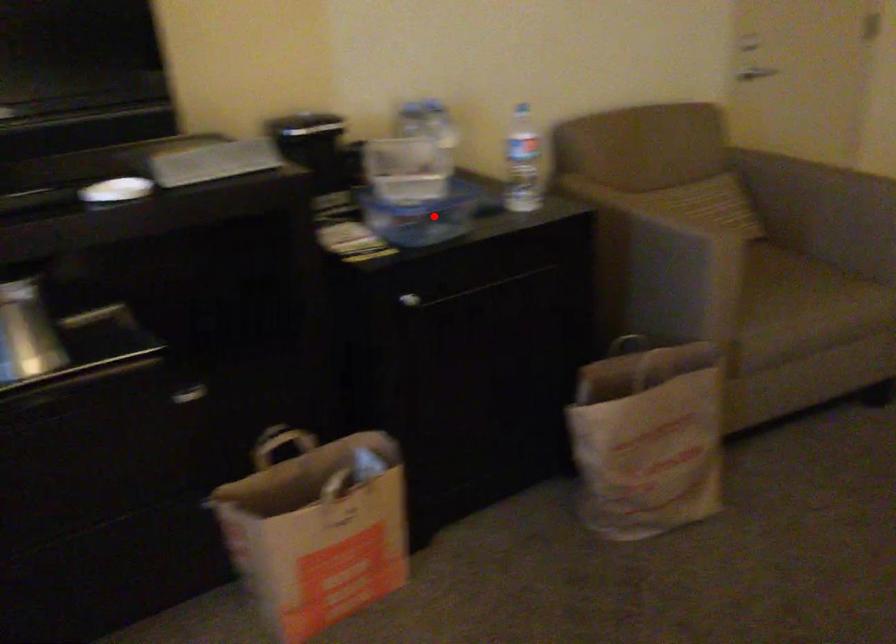
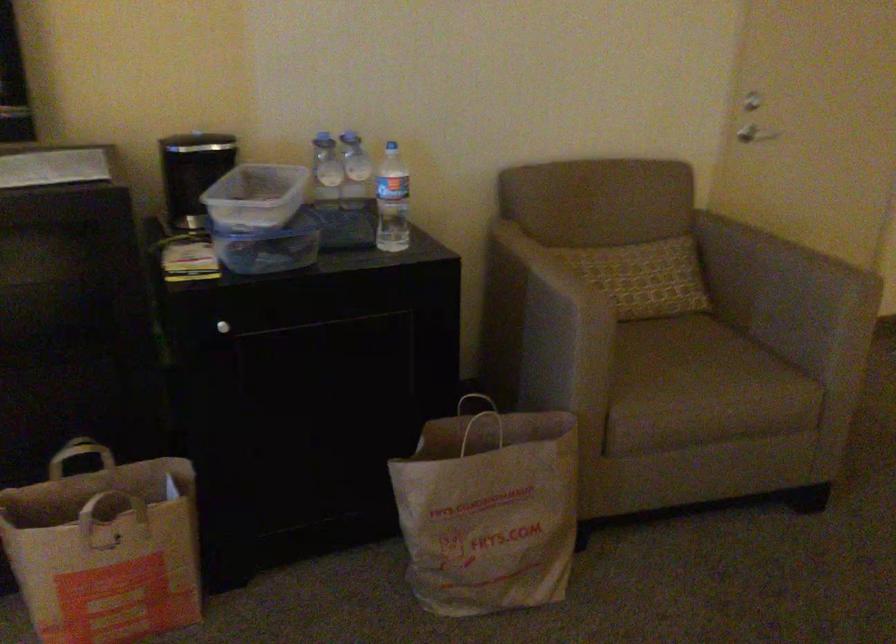
Where in the second image is the point corresponding to the highlighted location from the first image?

(269, 245)